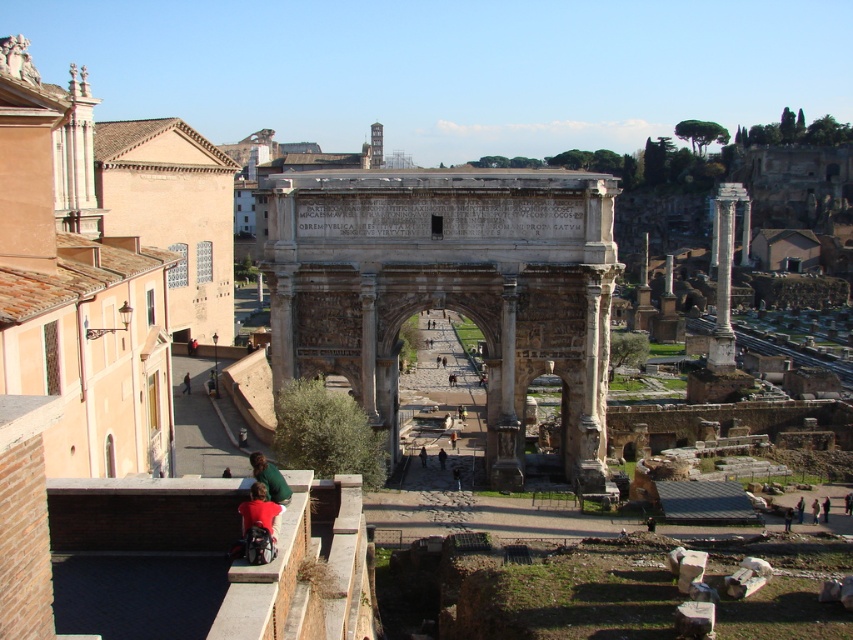
Question: Which is nearer to the dark brown fabric at center?

Choices:
 (A) white marble column at right
 (B) dark blue jeans at center

Answer: (B)

Question: Is green fabric at lower center closer to the viewer compared to dark blue jeans at center?

Choices:
 (A) no
 (B) yes

Answer: (B)

Question: Is white marble column at right to the right of green fabric at lower center from the viewer's perspective?

Choices:
 (A) no
 (B) yes

Answer: (B)

Question: Does dark blue jeans at center lie behind dark brown fabric at center?

Choices:
 (A) yes
 (B) no

Answer: (B)

Question: Considering the real-world distances, which object is farthest from the dark brown fabric at center?

Choices:
 (A) stone archway at center
 (B) green fabric at lower center
 (C) dark blue jeans at center
 (D) white marble column at right

Answer: (D)

Question: Which object is farther from the camera taking this photo?

Choices:
 (A) stone archway at center
 (B) dark blue jeans at center
 (C) dark brown fabric at center

Answer: (C)